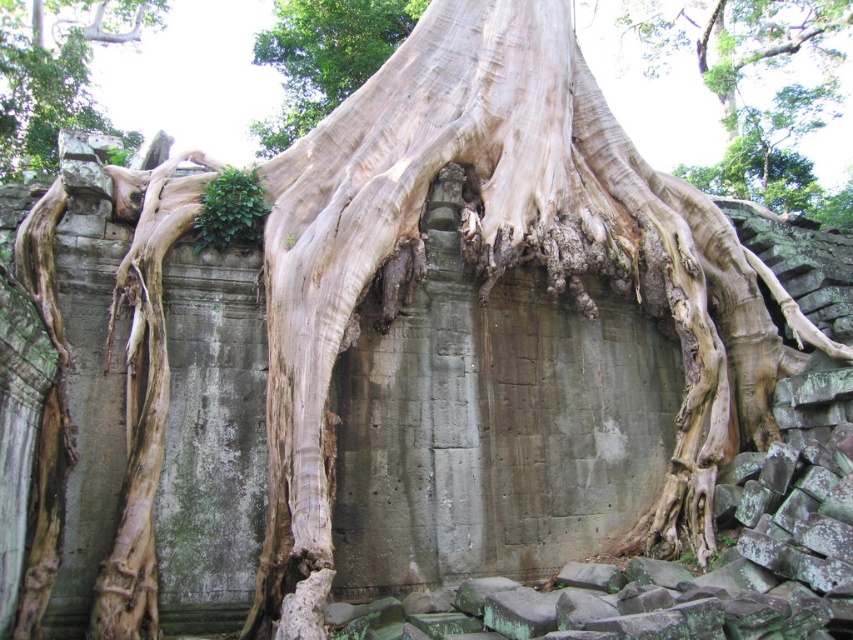
You are a botanist studying the growth patterns of ancient trees. You observe two trees in the image, the smooth bark tree trunk at upper left and the smooth bark tree trunk at center. Which tree trunk is positioned lower in the scene?

The smooth bark tree trunk at upper left is located below the smooth bark tree trunk at center, meaning it is positioned lower in the scene.

From the picture: You are an archaeologist examining the ancient stone structure. You notice two tree trunks in the scene. Which smooth bark tree trunk is nearer to you, the smooth bark tree trunk at upper left or the smooth bark tree trunk at center?

The smooth bark tree trunk at upper left is closer to the viewer than the smooth bark tree trunk at center.